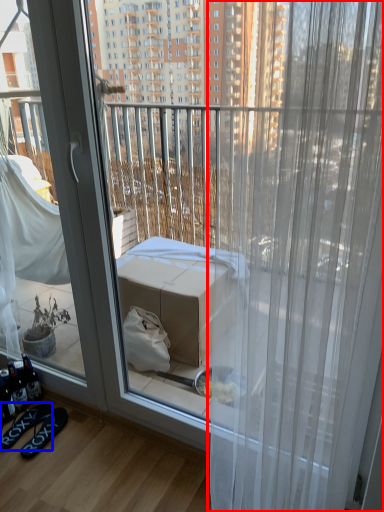
Question: Which of the following is the farthest to the observer, curtain (highlighted by a red box) or footwear (highlighted by a blue box)?

Choices:
 (A) curtain
 (B) footwear

Answer: (B)